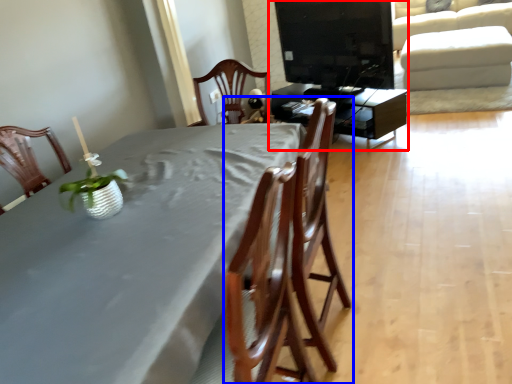
Question: Which object appears farthest to the camera in this image, entertainment center (highlighted by a red box) or chair (highlighted by a blue box)?

Choices:
 (A) entertainment center
 (B) chair

Answer: (A)